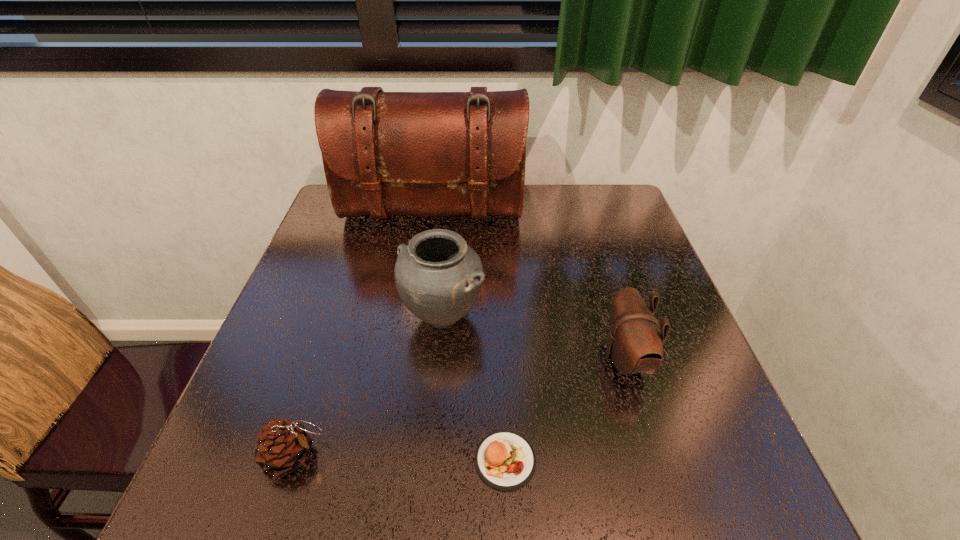
Locate an element on the screen. free space located with the flap open on the rightmost object is located at coordinates pos(480,359).

I want to click on vacant space located 0.220m with the flap open on the rightmost object, so click(x=495, y=359).

You are a GUI agent. You are given a task and a screenshot of the screen. Output one action in this format:
    pyautogui.click(x=<x>, y=<y>)
    Task: Click on the vacant space located 0.350m with a leaf charm attached to the pinecone
    Image resolution: width=960 pixels, height=540 pixels.
    Given the screenshot: What is the action you would take?
    pyautogui.click(x=533, y=456)

Identify the location of vacant space situated 0.170m on the left of the patty (food). This screenshot has width=960, height=540. (373, 460).

Identify the location of object that is at the far edge. The width and height of the screenshot is (960, 540). (384, 153).

Find the location of a particular element. pinecone that is at the near edge is located at coordinates (282, 446).

You are a GUI agent. You are given a task and a screenshot of the screen. Output one action in this format:
    pyautogui.click(x=<x>, y=<y>)
    Task: Click on the patty (food) present at the near edge
    The image size is (960, 540).
    Given the screenshot: What is the action you would take?
    coord(505,460)

Where is `satchel positioned at the left edge`? Image resolution: width=960 pixels, height=540 pixels. satchel positioned at the left edge is located at coordinates (384, 153).

This screenshot has width=960, height=540. Identify the location of pinecone that is at the left edge. (282, 446).

Where is `object that is at the right edge`? object that is at the right edge is located at coordinates (635, 345).